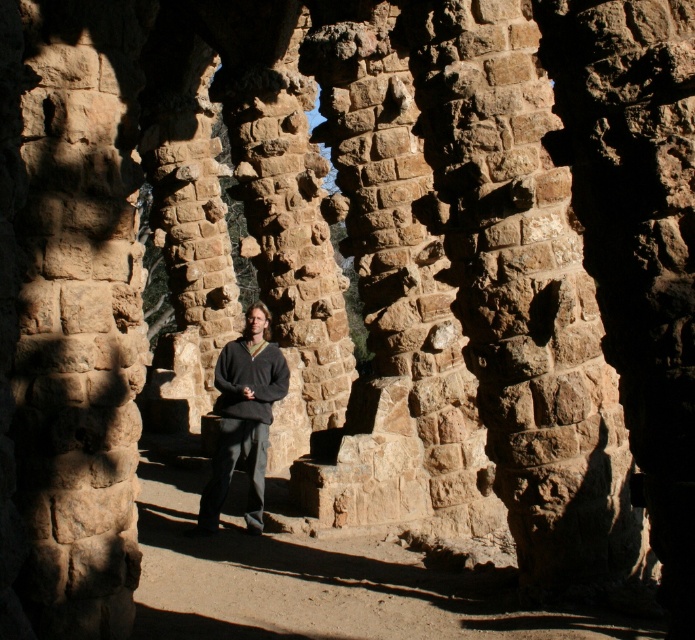
You are a tailor measuring two dark gray sweaters in the image. The first is labeled as dark gray sweater at center, and the second as dark gray wool sweater at center. Which one is closer to you?

The dark gray sweater at center is 5.57 feet from dark gray wool sweater at center, so they are the same object. Therefore, neither is closer since they are the same item.

You are a photographer trying to capture both the dark gray sweater at center and the dark gray wool sweater at center in the same frame. Which one should you focus on to ensure both are in focus?

You should focus on the dark gray sweater at center because it is closer to the viewer, and focusing on the closer object will keep both in focus due to the depth of field.

You are standing in a historical structure with stone columns. You see a point labeled at coordinates (243, 417). What object is located at that point?

The point at coordinates (243, 417) corresponds to the dark gray sweater at center.